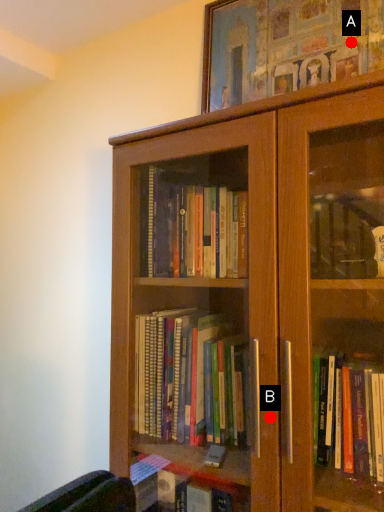
Question: Two points are circled on the image, labeled by A and B beside each circle. Which point is farther from the camera taking this photo?

Choices:
 (A) A is further
 (B) B is further

Answer: (A)